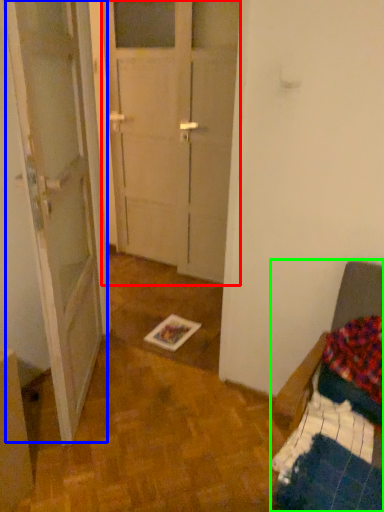
Question: Estimate the real-world distances between objects in this image. Which object is closer to glass door (highlighted by a red box), barn door (highlighted by a blue box) or furniture (highlighted by a green box)?

Choices:
 (A) barn door
 (B) furniture

Answer: (A)